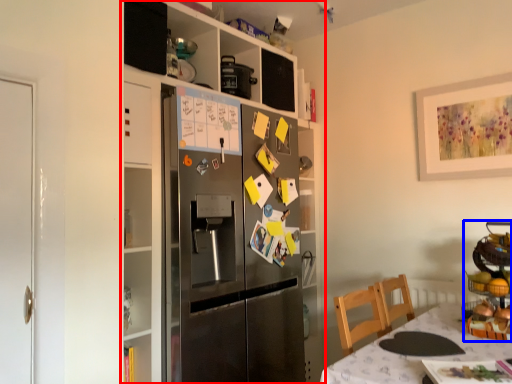
Question: Which of the following is the farthest to the observer, cabinetry (highlighted by a red box) or appliance (highlighted by a blue box)?

Choices:
 (A) cabinetry
 (B) appliance

Answer: (A)